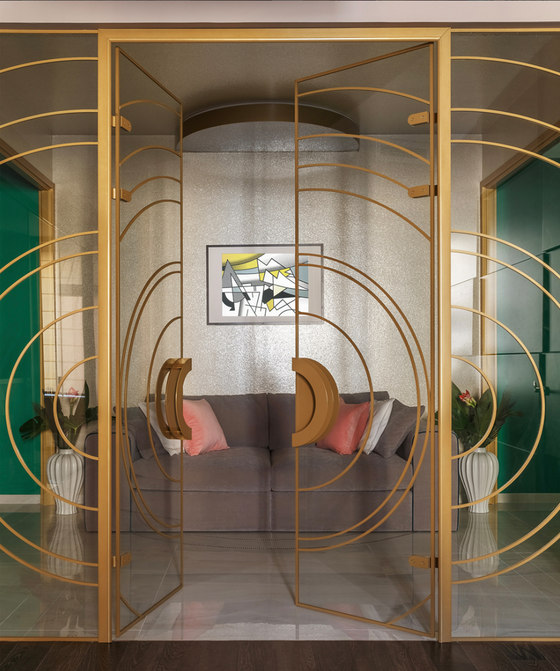
Locate an element on the screen. Image resolution: width=560 pixels, height=671 pixels. office ceiling is located at coordinates (150, 117), (393, 111).